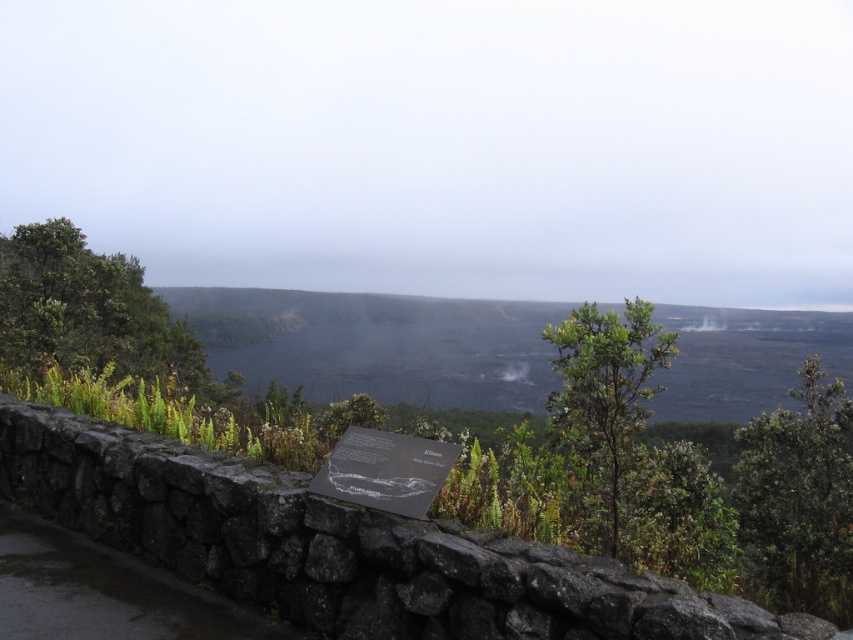
Does point (219, 432) lie in front of point (590, 324)?

No, (219, 432) is further to viewer.

Is green leafy shrubs at lower center further to the viewer compared to green leafy shrub at center?

That is True.

Does point (207, 413) lie behind point (560, 413)?

That is True.

Identify the location of green leafy shrubs at lower center. The image size is (853, 640). (672, 476).